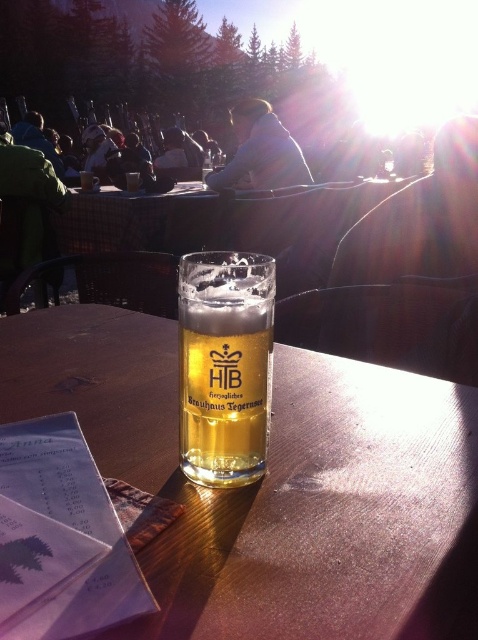
Question: Which object appears closest to the camera in this image?

Choices:
 (A) translucent glass at center
 (B) translucent glass beer at center

Answer: (A)

Question: Is translucent glass at center further to camera compared to translucent glass beer at center?

Choices:
 (A) no
 (B) yes

Answer: (A)

Question: Is translucent glass at center to the right of translucent glass beer at center from the viewer's perspective?

Choices:
 (A) yes
 (B) no

Answer: (B)

Question: Can you confirm if translucent glass at center is smaller than translucent glass beer at center?

Choices:
 (A) no
 (B) yes

Answer: (A)